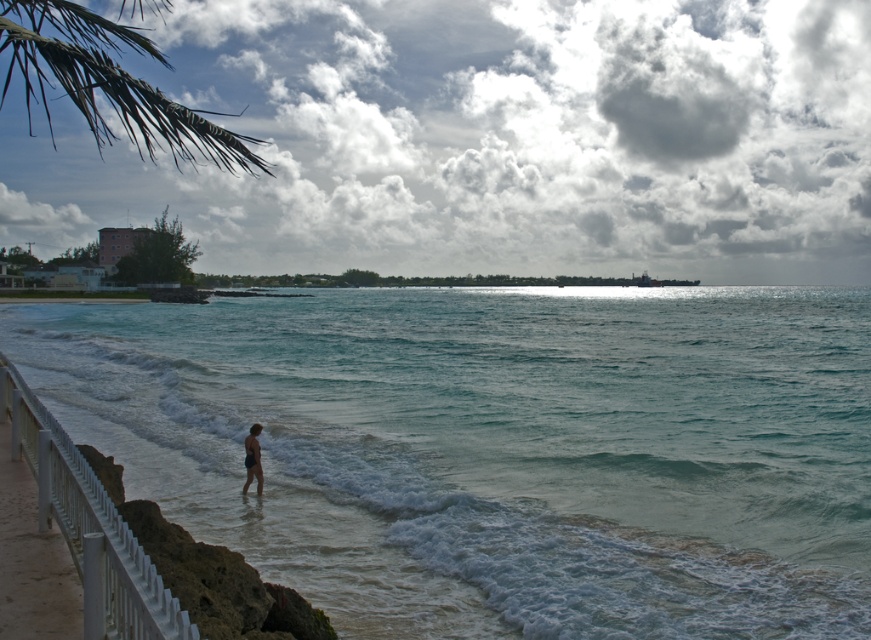
Does green leafy palm at upper left come in front of white glossy rail at lower left?

No, green leafy palm at upper left is further to the viewer.

Between point (2, 35) and point (37, 481), which one is positioned behind?

The point (37, 481) is more distant.

At what (x,y) coordinates should I click in order to perform the action: click on green leafy palm at upper left. Please return your answer as a coordinate pair (x, y). Looking at the image, I should click on pyautogui.click(x=107, y=83).

In the scene shown: Can you confirm if clear blue water at center is shorter than white glossy rail at lower left?

Incorrect, clear blue water at center's height does not fall short of white glossy rail at lower left's.

Who is more distant from viewer, (429, 493) or (120, 625)?

The point (429, 493) is behind.

I want to click on clear blue water at center, so click(x=498, y=449).

Who is positioned more to the left, clear blue water at center or matte black swimwear at lower center?

matte black swimwear at lower center

Can you confirm if clear blue water at center is positioned to the left of matte black swimwear at lower center?

Incorrect, clear blue water at center is not on the left side of matte black swimwear at lower center.

Image resolution: width=871 pixels, height=640 pixels. What are the coordinates of `clear blue water at center` in the screenshot? It's located at (498, 449).

Locate an element on the screen. This screenshot has width=871, height=640. clear blue water at center is located at coordinates (498, 449).